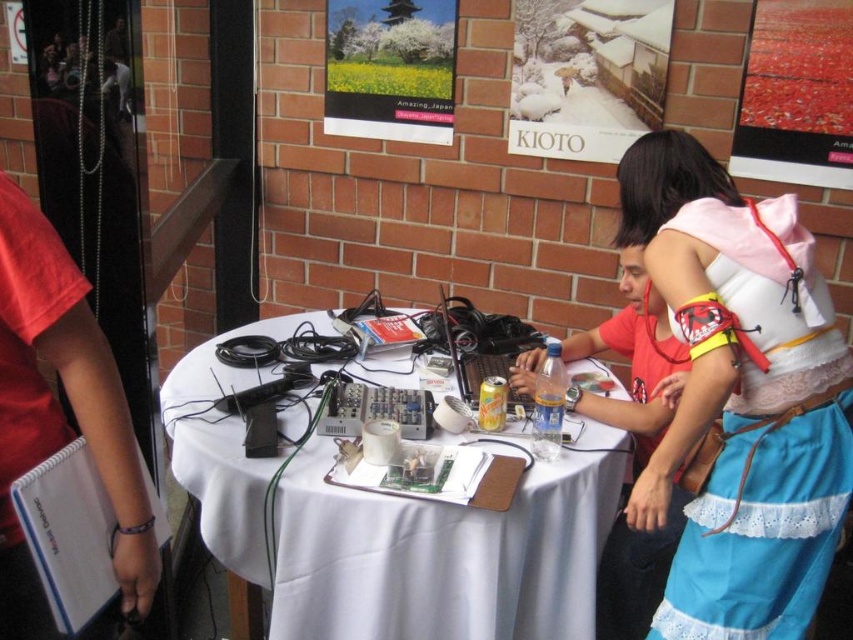
Question: Does white lace fabric skirt at lower right appear under snow-covered wooden house at upper center?

Choices:
 (A) no
 (B) yes

Answer: (B)

Question: Where is white lace fabric skirt at lower right located in relation to snow-covered wooden house at upper center in the image?

Choices:
 (A) below
 (B) above

Answer: (A)

Question: Which object is the closest to the red fabric poster at upper right?

Choices:
 (A) matte paper poster at upper center
 (B) white cloth-covered table at center

Answer: (A)

Question: Is white cloth-covered table at center positioned at the back of matte paper poster at upper center?

Choices:
 (A) no
 (B) yes

Answer: (A)

Question: Considering the real-world distances, which object is closest to the matte paper poster at upper center?

Choices:
 (A) snow-covered wooden house at upper center
 (B) white cloth-covered table at center
 (C) white lace fabric skirt at lower right

Answer: (A)

Question: Which object appears farthest from the camera in this image?

Choices:
 (A) snow-covered wooden house at upper center
 (B) white lace fabric skirt at lower right

Answer: (A)